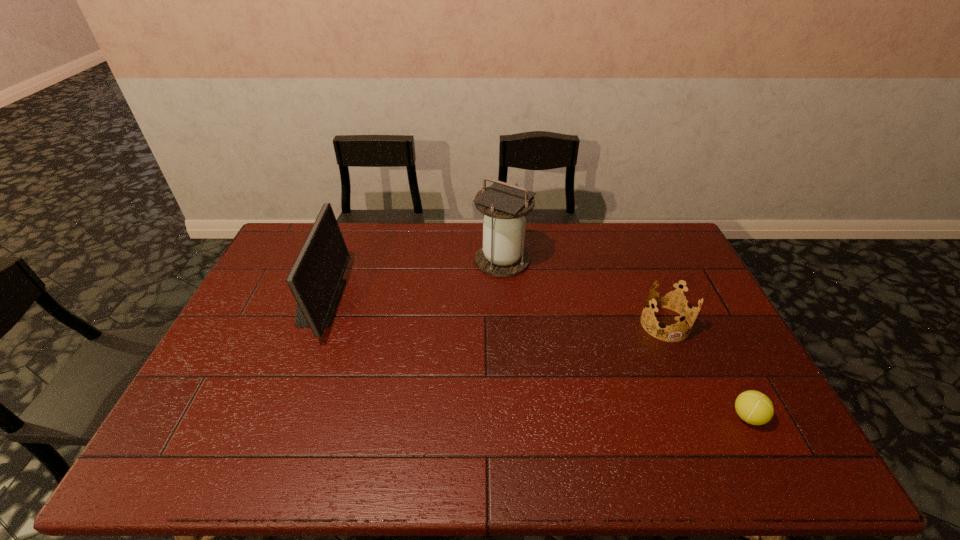
Identify the location of vacant area that lies between the third tallest object and the tennis ball. (707, 370).

Locate an element on the screen. The height and width of the screenshot is (540, 960). free space between the computer monitor and the second object from left to right is located at coordinates (411, 281).

At what (x,y) coordinates should I click in order to perform the action: click on vacant space in between the nearest object and the second shortest object. Please return your answer as a coordinate pair (x, y). The image size is (960, 540). Looking at the image, I should click on [707, 370].

Identify the location of vacant region between the third tallest object and the third shortest object. (492, 313).

At what (x,y) coordinates should I click in order to perform the action: click on empty location between the leftmost object and the crown. Please return your answer as a coordinate pair (x, y). The image size is (960, 540). Looking at the image, I should click on (492, 313).

Where is `vacant area between the second object from left to right and the tennis ball`? This screenshot has height=540, width=960. vacant area between the second object from left to right and the tennis ball is located at coordinates (625, 339).

This screenshot has width=960, height=540. I want to click on vacant space that is in between the tallest object and the leftmost object, so click(411, 281).

You are a GUI agent. You are given a task and a screenshot of the screen. Output one action in this format:
    pyautogui.click(x=<x>, y=<y>)
    Task: Click on the free spot between the tallest object and the crown
    The width and height of the screenshot is (960, 540).
    Given the screenshot: What is the action you would take?
    pyautogui.click(x=584, y=292)

Locate an element on the screen. This screenshot has height=540, width=960. the third closest object to the second shortest object is located at coordinates (315, 279).

Identify the location of object that is the third closest to the second object from left to right. Image resolution: width=960 pixels, height=540 pixels. (753, 407).